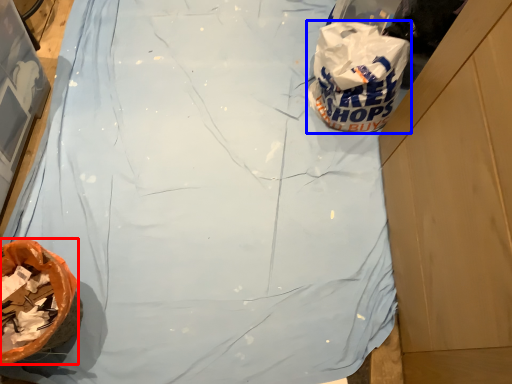
Question: Which of the following is the farthest to the observer, waste (highlighted by a red box) or plastic bag (highlighted by a blue box)?

Choices:
 (A) waste
 (B) plastic bag

Answer: (B)